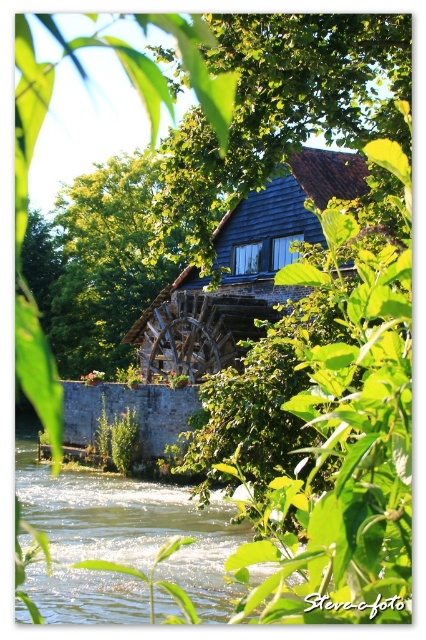
You are standing at the riverside and want to take a photo of the watermill. The camera you are using has a maximum focus range of 40 meters. Will the point at point (325, 61) be within the camera focus range?

The distance of point (325, 61) from the camera is 42.42 meters, which exceeds the camera maximum focus range of 40 meters. Therefore, the point will not be within the camera focus range.

You are standing at the riverside and looking at the traditional watermill. There are two points marked in the image, point 1 at coordinates [357,97] and point 2 at coordinates [178,513]. Which point is closer to your viewpoint?

Point 1 at coordinates [357,97] is closer to your viewpoint because it is closer to the camera than point 2 at coordinates [178,513].

You are a visitor standing at the riverside near the watermill. You see the green water at lower left and the green leafy tree at center. Which object is positioned to the right side of the other?

The green water at lower left is to the right of the green leafy tree at center.